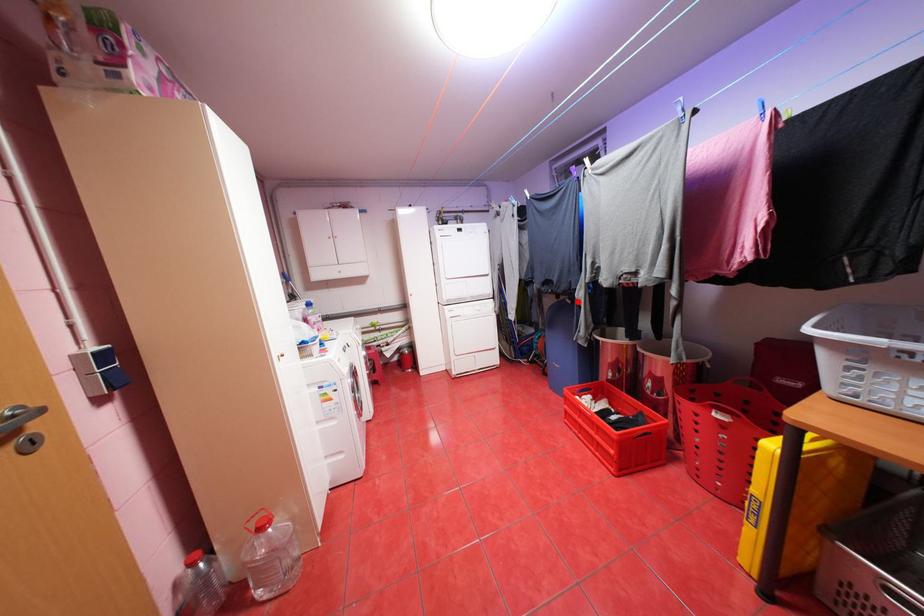
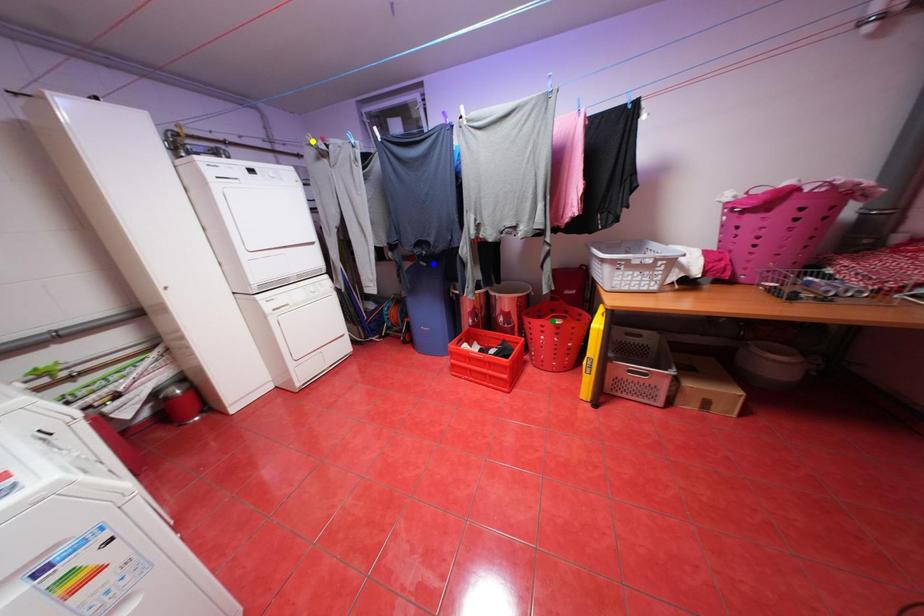
Question: I am providing you with two images of the same scene from different viewpoints. A red point is marked on the first image. You are given multiple points on the second image. In image 2, which mark is for the same physical point as the one in image 1?

Choices:
 (A) green point
 (B) yellow point
 (C) blue point

Answer: (C)